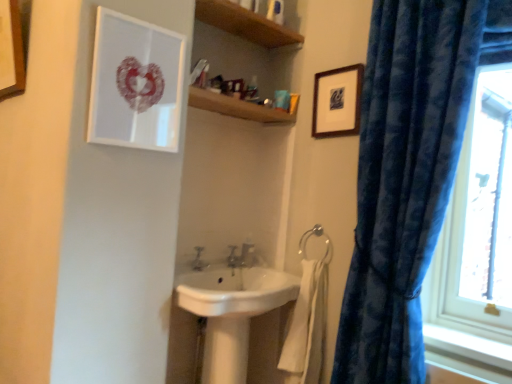
Question: From the image's perspective, is white plastic tube at upper center located above or below wooden picture frame at upper left, acting as the 1th picture frame starting from the left?

Choices:
 (A) below
 (B) above

Answer: (B)

Question: Considering the relative positions of white plastic tube at upper center and wooden picture frame at upper left, acting as the 1th picture frame starting from the left, in the image provided, is white plastic tube at upper center to the left or to the right of wooden picture frame at upper left, acting as the 1th picture frame starting from the left,?

Choices:
 (A) left
 (B) right

Answer: (B)

Question: Considering the real-world distances, which object is closest to the matte silver tap at center?

Choices:
 (A) white ceramic faucet at center, the 1th plumbing fixture in the right-to-left sequence
 (B) white cotton bath towel at lower center
 (C) white plastic tube at upper center
 (D) wooden picture frame at upper left, acting as the 1th picture frame starting from the left
 (E) silver metallic towel bar at center

Answer: (A)

Question: Estimate the real-world distances between objects in this image. Which object is closer to the white glossy pillar at center?

Choices:
 (A) white ceramic faucet at center, the 1th plumbing fixture in the right-to-left sequence
 (B) white plastic tube at upper center
 (C) wooden picture frame at upper left, marked as the third picture frame in a right-to-left arrangement
 (D) transparent glass window at right
 (E) matte silver tap at center

Answer: (E)